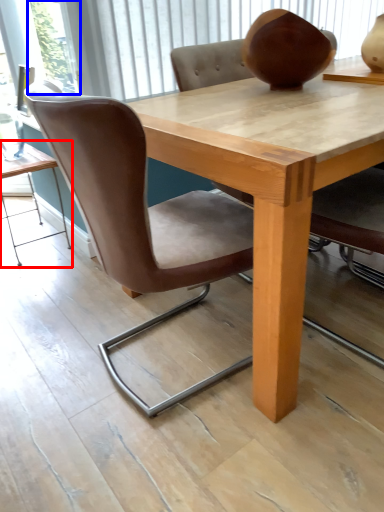
Question: Among these objects, which one is nearest to the camera, table (highlighted by a red box) or glass door (highlighted by a blue box)?

Choices:
 (A) table
 (B) glass door

Answer: (B)